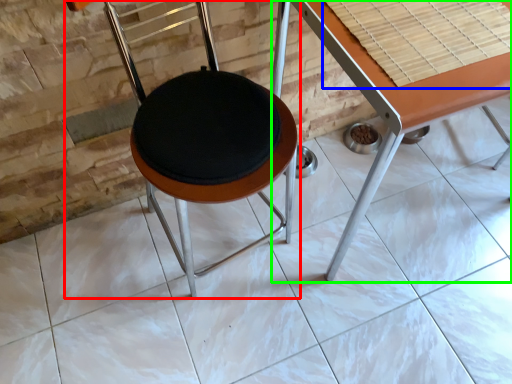
Question: Considering the real-world distances, which object is farthest from chair (highlighted by a red box)? table top (highlighted by a blue box) or table (highlighted by a green box)?

Choices:
 (A) table top
 (B) table

Answer: (A)